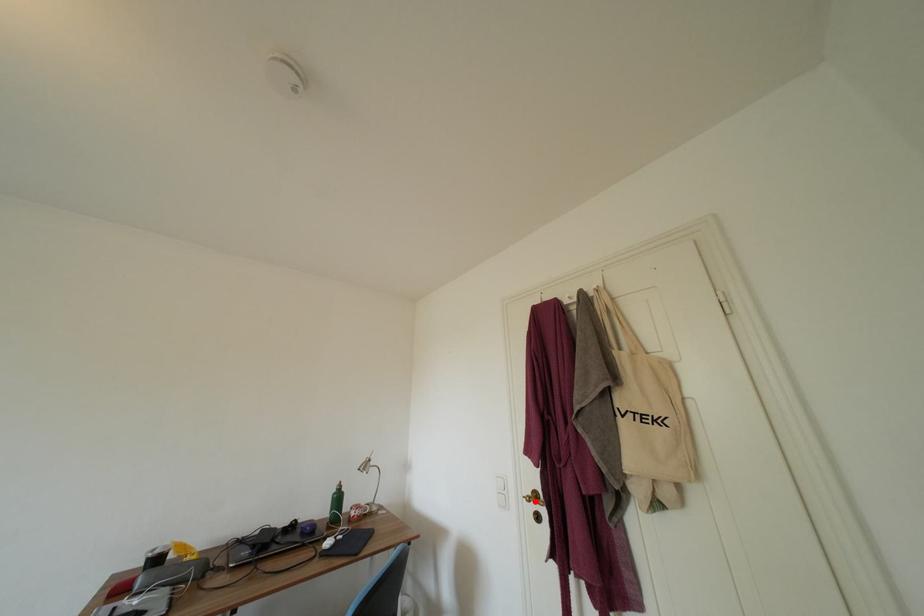
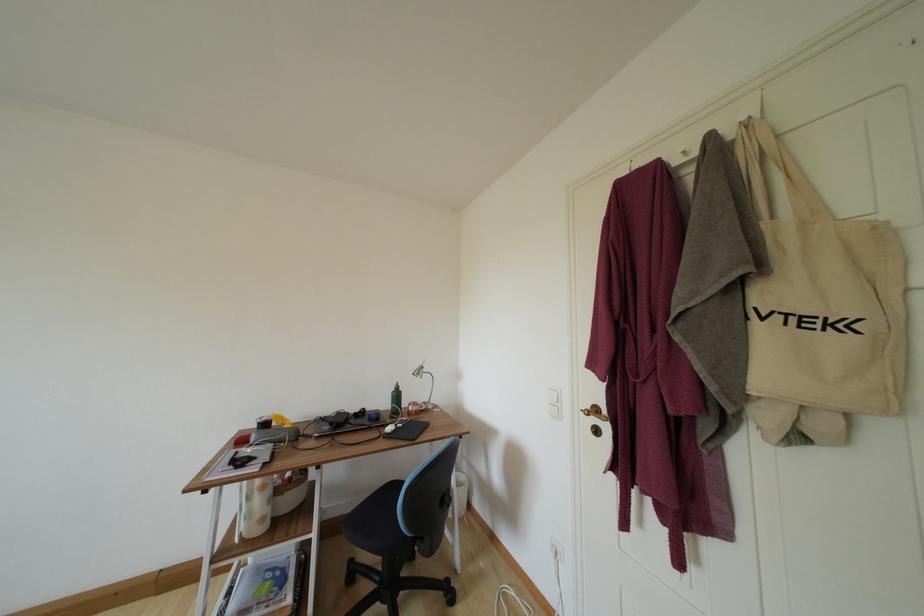
Question: I am providing you with two images of the same scene from different viewpoints. Image1 has a red point marked. In image2, the corresponding 3D location appears at what relative position? Reply with the corresponding letter.

Choices:
 (A) Closer
 (B) Farther

Answer: (A)